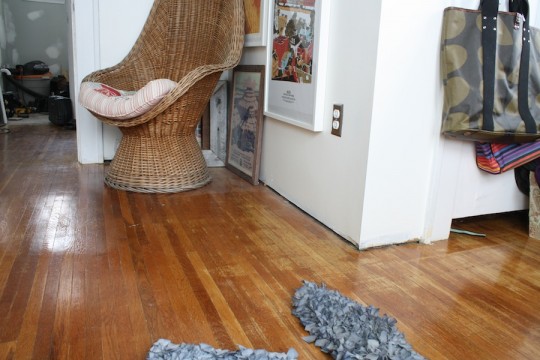
Where is `doorway`? Image resolution: width=540 pixels, height=360 pixels. doorway is located at coordinates click(x=69, y=23).